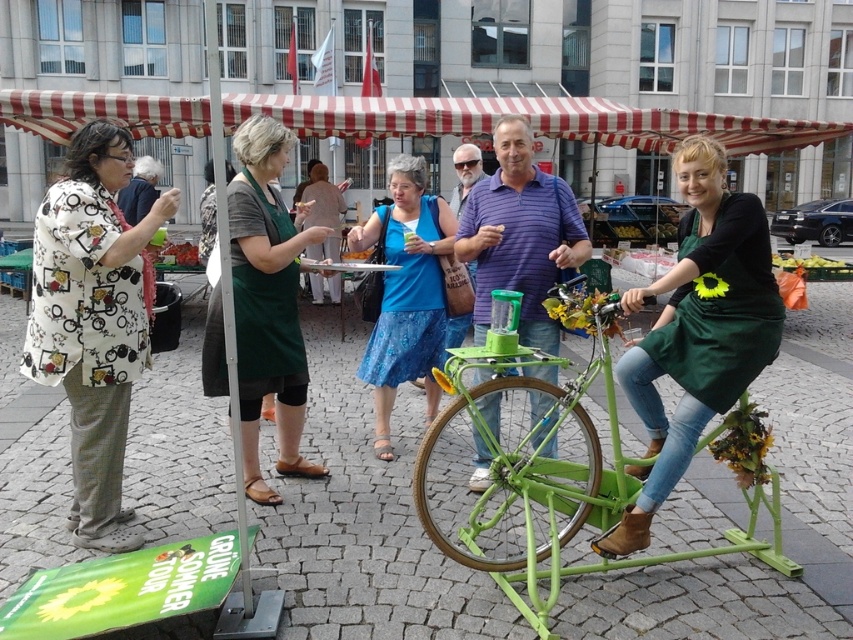
Question: Is green matte bicycle at lower right further to the viewer compared to green apron at center?

Choices:
 (A) yes
 (B) no

Answer: (B)

Question: Estimate the real-world distances between objects in this image. Which object is farther from the blue fabric dress at center?

Choices:
 (A) green matte bicycle at center
 (B) green matte bicycle at lower right
 (C) smooth red tomatoes at center
 (D) green matte apron at center

Answer: (C)

Question: Which point appears closest to the camera in this image?

Choices:
 (A) (187, 244)
 (B) (117, 502)
 (C) (378, 368)

Answer: (B)

Question: Is the position of white printed blouse at left more distant than that of green matte bicycle at center?

Choices:
 (A) yes
 (B) no

Answer: (B)

Question: Estimate the real-world distances between objects in this image. Which object is closer to the blue fabric dress at center?

Choices:
 (A) green apron at center
 (B) green matte bicycle at center
 (C) smooth red tomatoes at center

Answer: (B)

Question: Can you confirm if green matte apron at center is positioned to the left of smooth red tomatoes at center?

Choices:
 (A) no
 (B) yes

Answer: (A)